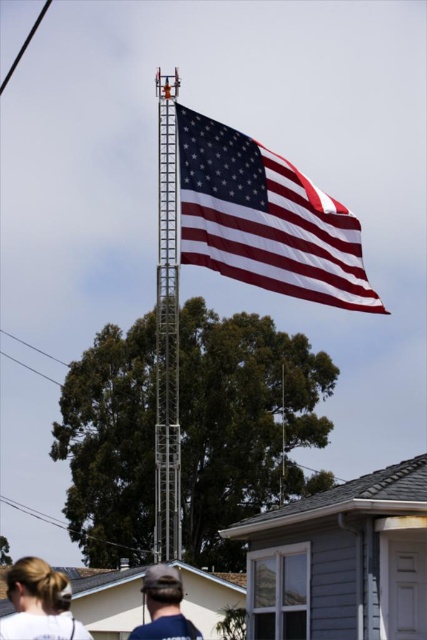
Question: Which of the following is the closest to the observer?

Choices:
 (A) (29, 576)
 (B) (193, 628)
 (C) (379, 301)

Answer: (B)

Question: Which point is closer to the camera?

Choices:
 (A) blonde hair at lower left
 (B) polished cotton flag at upper center

Answer: (A)

Question: Observing the image, what is the correct spatial positioning of polished cotton flag at upper center in reference to blonde hair at lower left?

Choices:
 (A) below
 (B) above

Answer: (B)

Question: Can you confirm if blonde hair at lower left is wider than blue denim shirt at lower center?

Choices:
 (A) no
 (B) yes

Answer: (B)

Question: Among these points, which one is farthest from the camera?

Choices:
 (A) (79, 636)
 (B) (170, 568)

Answer: (B)

Question: Does polished cotton flag at upper center have a lesser width compared to blonde hair at lower left?

Choices:
 (A) yes
 (B) no

Answer: (A)